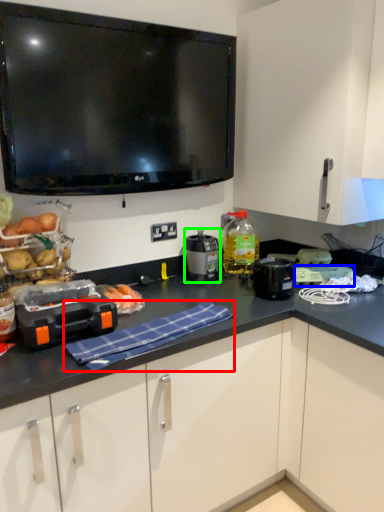
Question: Based on their relative distances, which object is farther from cloth (highlighted by a red box)? Choose from appliance (highlighted by a blue box) and kitchen appliance (highlighted by a green box).

Choices:
 (A) appliance
 (B) kitchen appliance

Answer: (A)